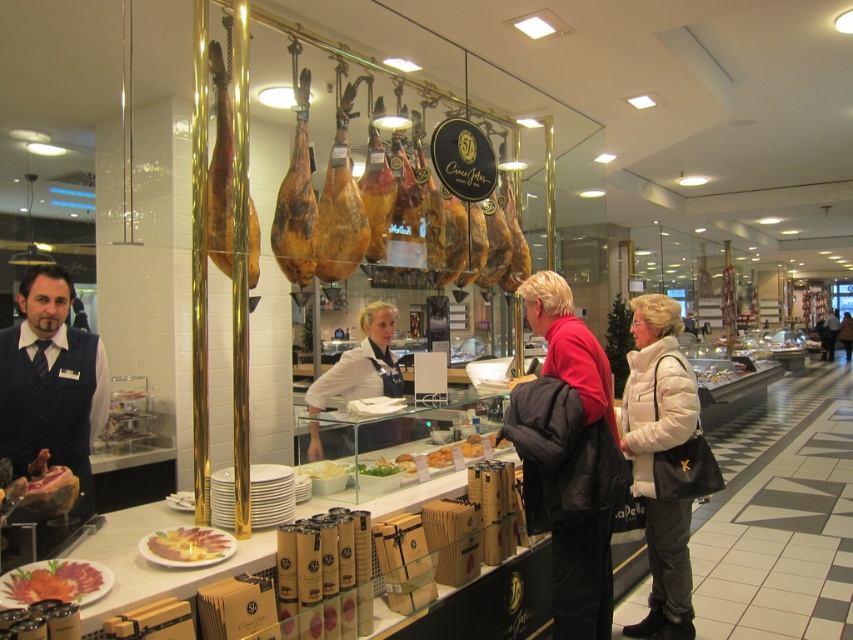
You are a customer standing at the counter in front of the deli display. You need to reach the gold polished ham at center to grab a sample. However, there is a staff member in a matte black vest at left blocking your path. Can you easily access the ham without moving the staff member?

The matte black vest at left is closer to the viewer than the gold polished ham at center, so the staff member is blocking your direct path. You would need to move around them to access the ham.

You are a customer at the deli counter. You see the matte black vest at left and the gold polished ham at center. Which item is positioned more to the left side of the counter?

The matte black vest at left is positioned more to the left side of the counter than the gold polished ham at center.

You are a customer in the store and want to buy the gold polished ham at center. The store has a rule that you must first approach the counter before purchasing any item. Based on your current position at point (x=219, y=170), can you reach the counter without passing through the gold polished ham at center?

The point (x=219, y=170) is on the gold polished ham at center, so you are currently standing at the ham. To reach the counter, you would need to move away from the ham to the counter, so you can reach the counter without passing through the ham itself since you start at the ham and move towards the counter.